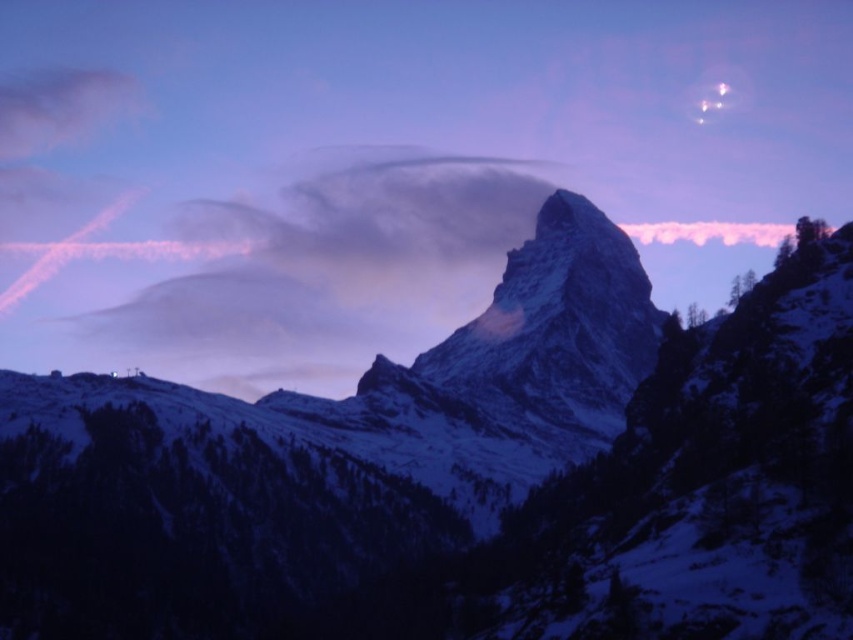
You are an airplane passenger looking out the window and see the snowy granite mountain at center and the white fluffy cloud at center. Which object is located to the right of the other?

The snowy granite mountain at center is positioned on the right side of white fluffy cloud at center, so the snowy granite mountain at center is to the right of the white fluffy cloud at center.

Based on the coordinates provided, where is the snowy granite mountain at center located in the image?

The snowy granite mountain at center is located at point (465, 474).